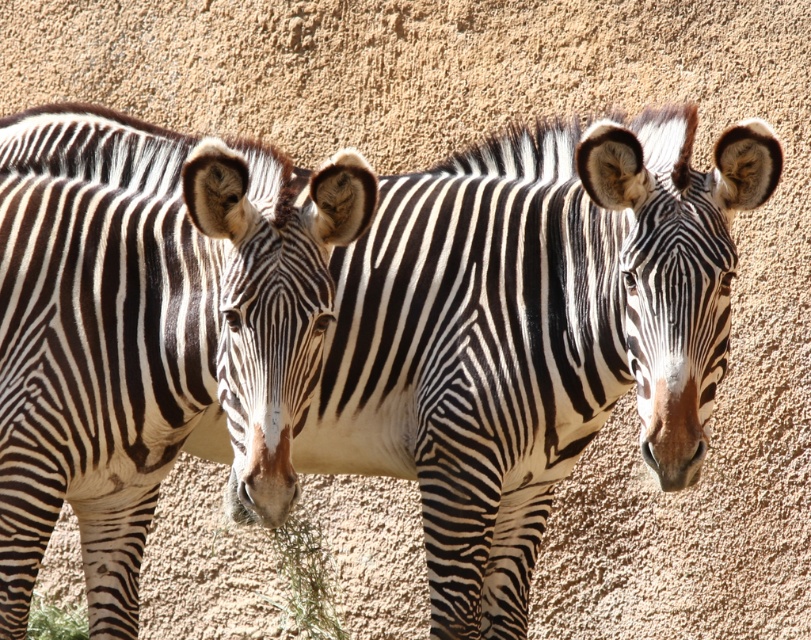
Question: Is black and white striped zebra at left bigger than green leafy grass at lower center?

Choices:
 (A) yes
 (B) no

Answer: (A)

Question: Estimate the real-world distances between objects in this image. Which object is closer to the black and white striped zebra at left?

Choices:
 (A) green leafy grass at lower center
 (B) green leafy grass at lower left

Answer: (A)

Question: In this image, where is black and white striped zebra at left located relative to green leafy grass at lower center?

Choices:
 (A) below
 (B) above

Answer: (B)

Question: Considering the real-world distances, which object is farthest from the black and white striped zebra at left?

Choices:
 (A) green leafy grass at lower left
 (B) green leafy grass at lower center

Answer: (A)

Question: Which point is farther to the camera?

Choices:
 (A) (67, 616)
 (B) (286, 577)

Answer: (A)

Question: Can you confirm if black and white striped zebra at left is positioned below green leafy grass at lower center?

Choices:
 (A) no
 (B) yes

Answer: (A)